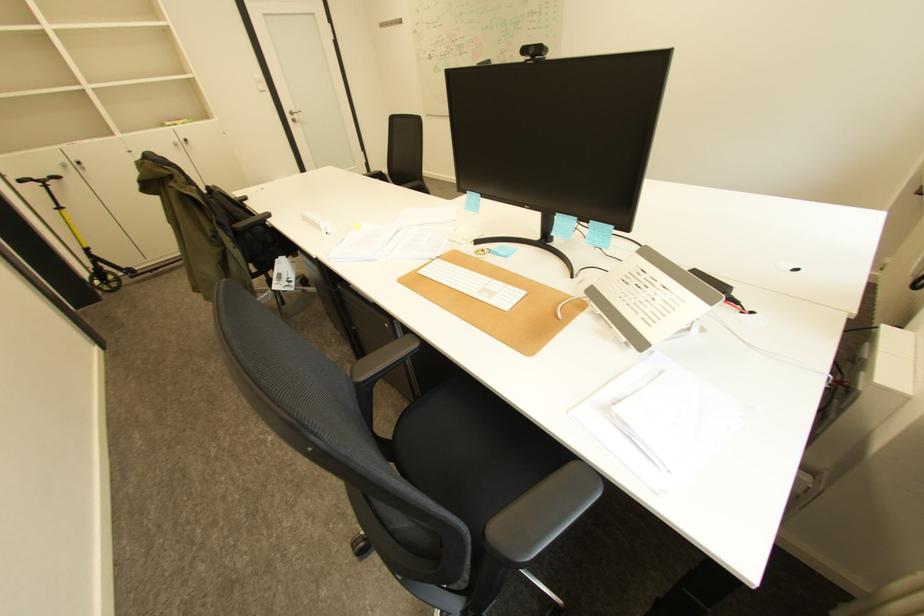
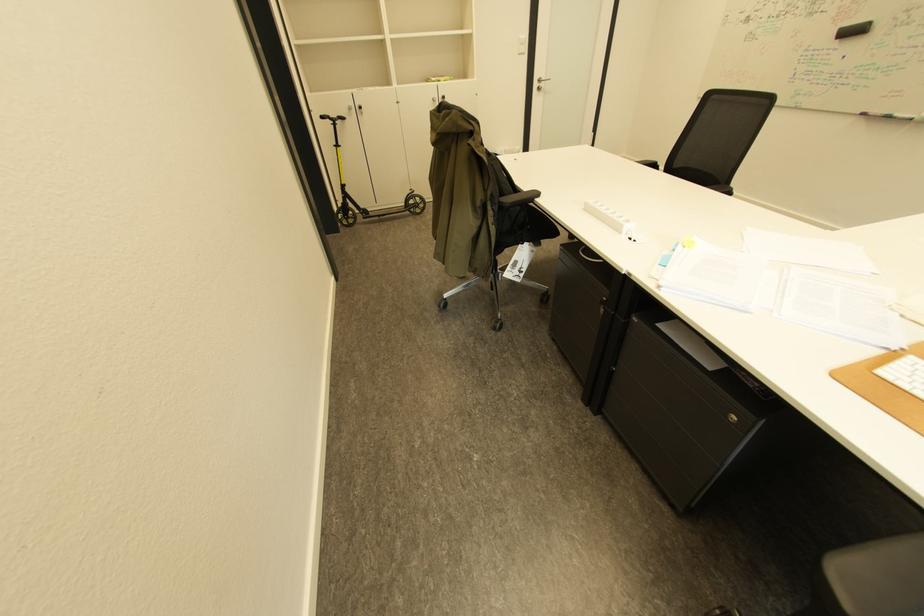
Question: How did the camera likely rotate?

Choices:
 (A) Left
 (B) Right
 (C) Up
 (D) Down

Answer: (A)